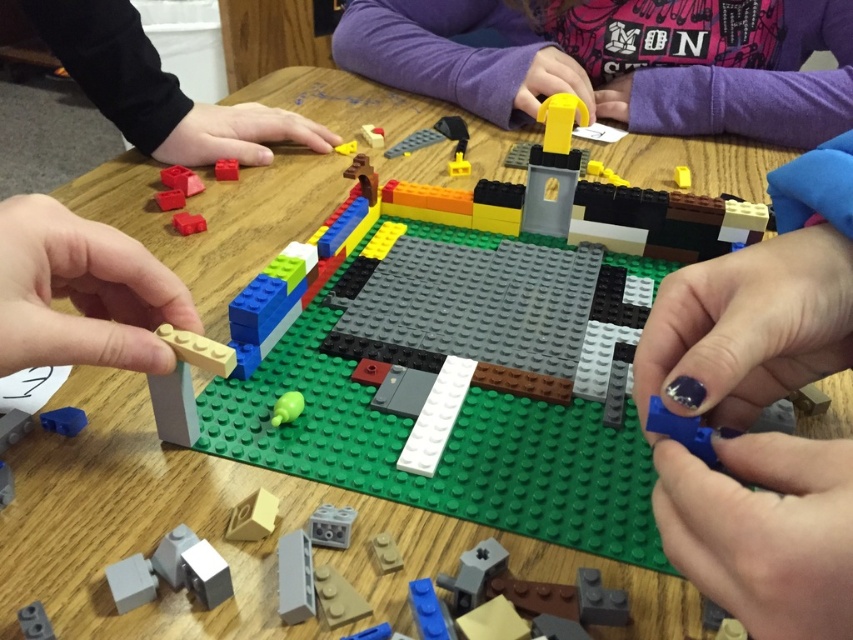
Based on the photo, looking at the LEGO construction scene, where is the matte black hand at upper left in relation to the wooden block at lower left?

The matte black hand at upper left is to the left of the wooden block at lower left.